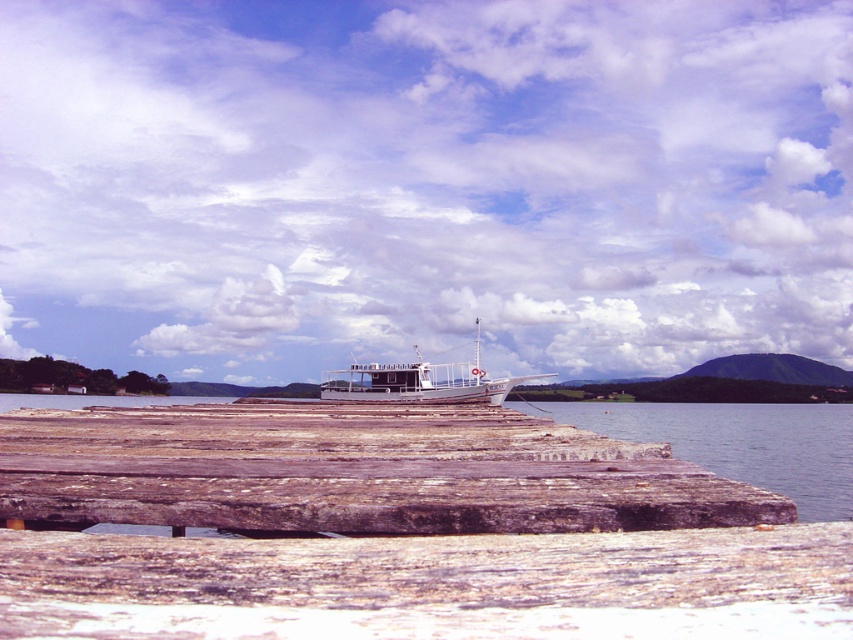
Between weathered wood dock at center and clear water at dock right, which one appears on the right side from the viewer's perspective?

clear water at dock right

Looking at this image, which of these two, weathered wood dock at center or clear water at dock right, stands taller?

clear water at dock right is taller.

Is point (106, 470) more distant than point (753, 410)?

No, it is in front of (753, 410).

This screenshot has width=853, height=640. I want to click on weathered wood dock at center, so click(354, 472).

Is clear water at dock right to the right of white wooden boat at center from the viewer's perspective?

Yes, clear water at dock right is to the right of white wooden boat at center.

Is point (608, 401) closer to viewer compared to point (341, 387)?

No.

Describe the element at coordinates (738, 442) in the screenshot. I see `clear water at dock right` at that location.

Where is `clear water at dock right`? This screenshot has width=853, height=640. clear water at dock right is located at coordinates coord(738,442).

Which of these two, weathered wood dock at center or white wooden boat at center, stands taller?

With more height is white wooden boat at center.

The height and width of the screenshot is (640, 853). What do you see at coordinates (354, 472) in the screenshot? I see `weathered wood dock at center` at bounding box center [354, 472].

Where is `weathered wood dock at center`? The height and width of the screenshot is (640, 853). weathered wood dock at center is located at coordinates (354, 472).